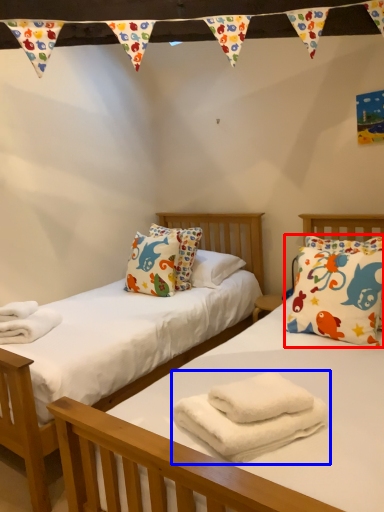
Question: Which object is further to the camera taking this photo, pillow (highlighted by a red box) or bath towel (highlighted by a blue box)?

Choices:
 (A) pillow
 (B) bath towel

Answer: (A)